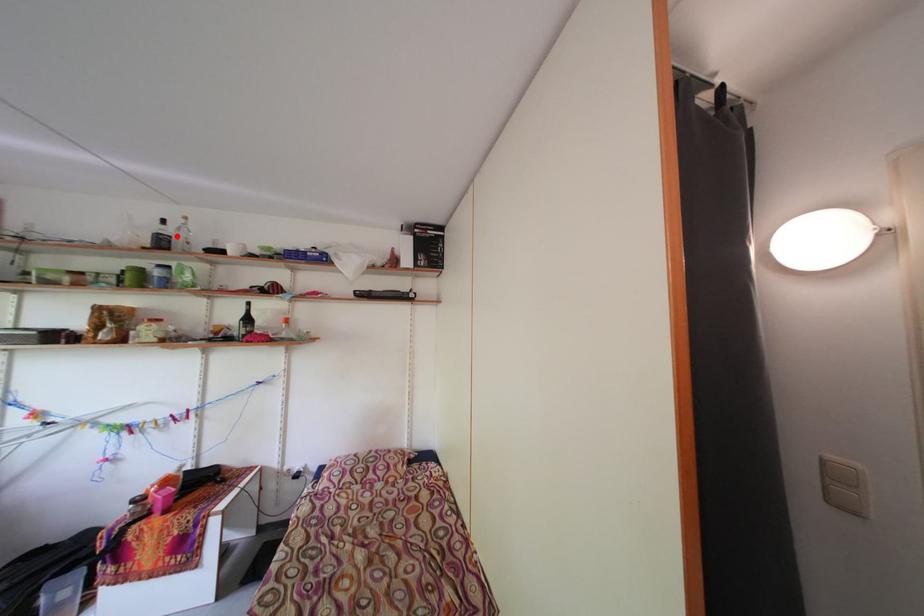
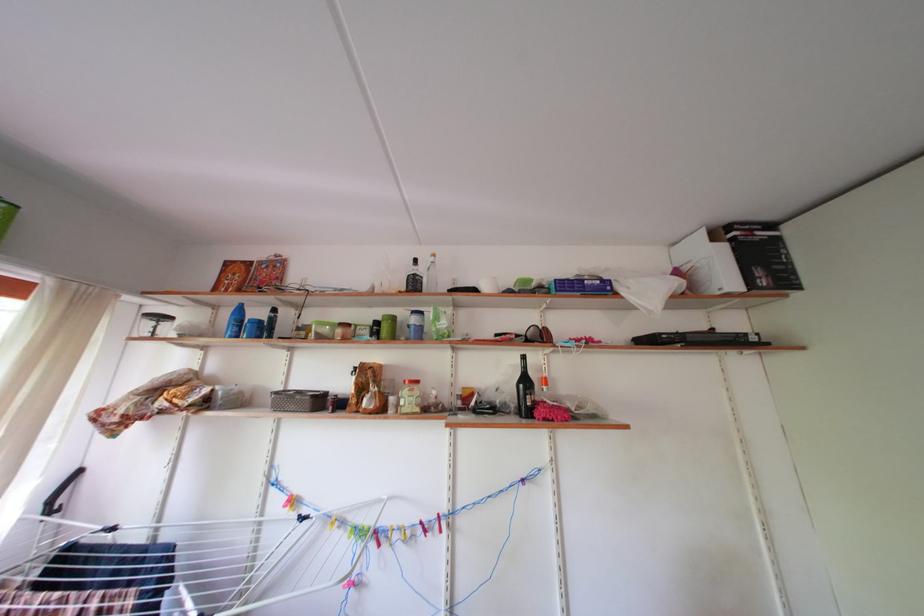
Where in the second image is the point corresponding to the highlighted location from the first image?

(430, 276)